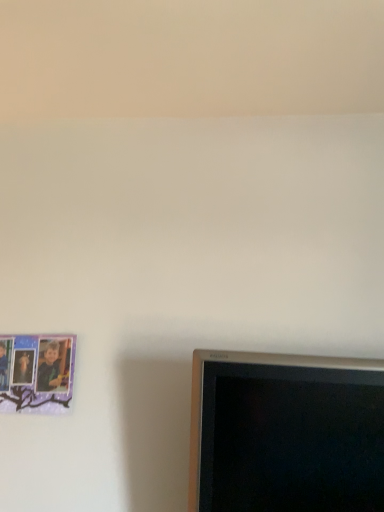
The width and height of the screenshot is (384, 512). What do you see at coordinates (36, 373) in the screenshot?
I see `purple paper picture frame at lower left` at bounding box center [36, 373].

What are the coordinates of `purple paper picture frame at lower left` in the screenshot? It's located at (36, 373).

What is the approximate width of purple paper picture frame at lower left?

purple paper picture frame at lower left is 2.64 centimeters in width.

The image size is (384, 512). Identify the location of purple paper picture frame at lower left. (36, 373).